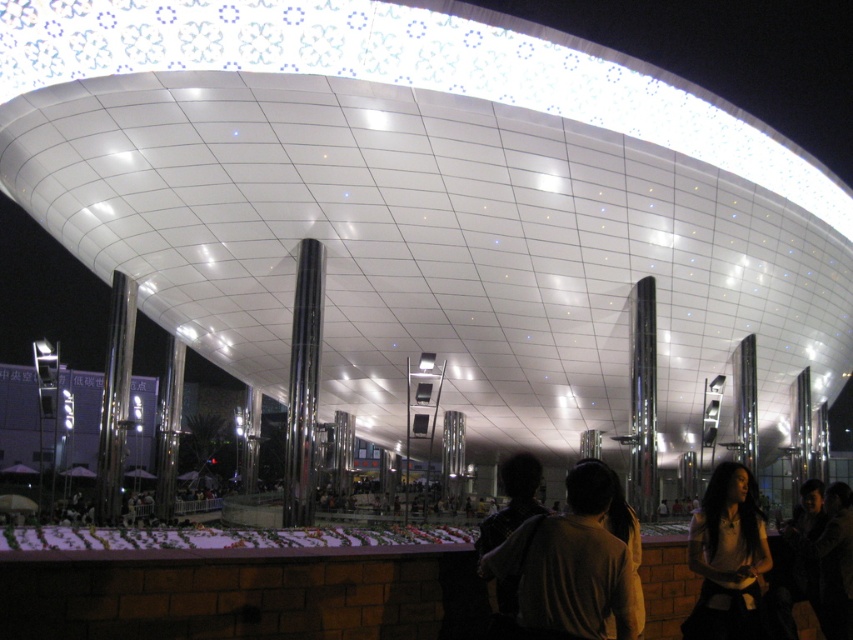
Question: Which point is farther to the camera?

Choices:
 (A) matte white blouse at center
 (B) dark brown hair at center

Answer: (A)

Question: Is dark brown hair at center smaller than matte white blouse at center?

Choices:
 (A) no
 (B) yes

Answer: (A)

Question: Is dark brown hair at center behind matte white blouse at center?

Choices:
 (A) no
 (B) yes

Answer: (A)

Question: Can you confirm if dark brown hair at center is smaller than matte white blouse at center?

Choices:
 (A) no
 (B) yes

Answer: (A)